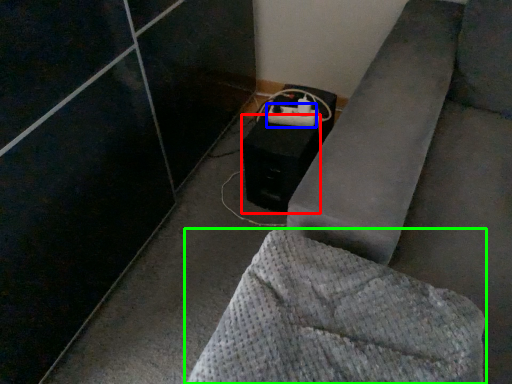
Question: Estimate the real-world distances between objects in this image. Which object is farther from speaker (highlighted by a red box), extension cord (highlighted by a blue box) or furniture (highlighted by a green box)?

Choices:
 (A) extension cord
 (B) furniture

Answer: (B)